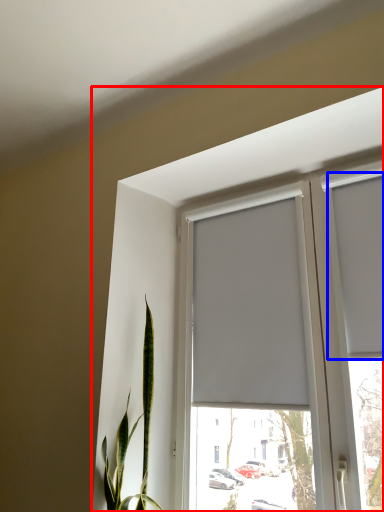
Question: Which object is further to the camera taking this photo, window (highlighted by a red box) or curtain (highlighted by a blue box)?

Choices:
 (A) window
 (B) curtain

Answer: (B)